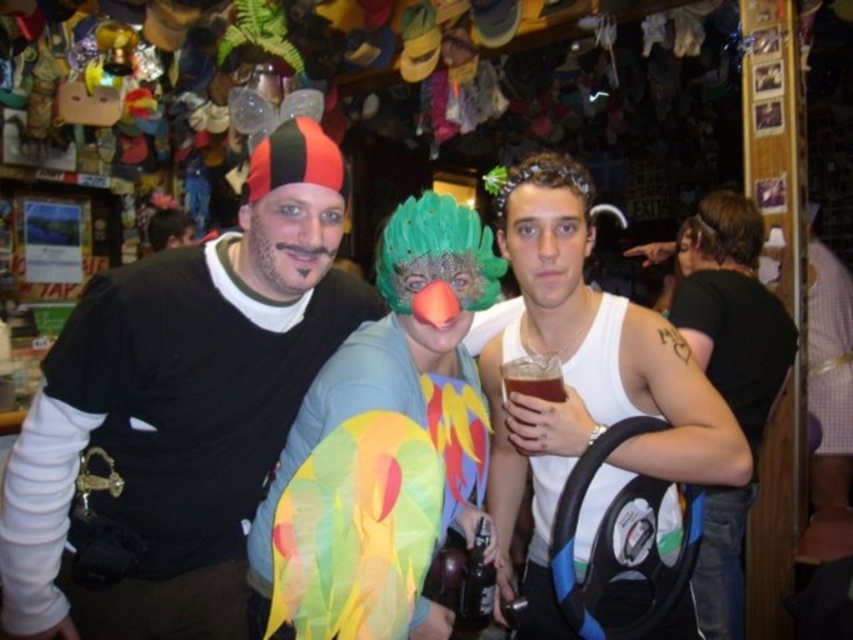
Question: Which point is closer to the camera?

Choices:
 (A) (492, 188)
 (B) (822, 301)
 (C) (762, 380)
 (D) (509, 365)

Answer: (D)

Question: Is brown fuzzy wig at upper right bigger than brown glass beer at center?

Choices:
 (A) no
 (B) yes

Answer: (B)

Question: From the image, what is the correct spatial relationship of white tank top at center in relation to black tattooed arm at right?

Choices:
 (A) above
 (B) below

Answer: (A)

Question: Which of the following is the farthest from the observer?

Choices:
 (A) (546, 356)
 (B) (718, 280)
 (C) (573, 308)

Answer: (B)

Question: Considering the relative positions of black tattooed arm at right and brown fuzzy wig at upper right in the image provided, where is black tattooed arm at right located with respect to brown fuzzy wig at upper right?

Choices:
 (A) right
 (B) left

Answer: (B)

Question: Which object appears farthest from the camera in this image?

Choices:
 (A) brushed metal fork at upper right
 (B) white tank top at center
 (C) black matte shirt at center

Answer: (A)